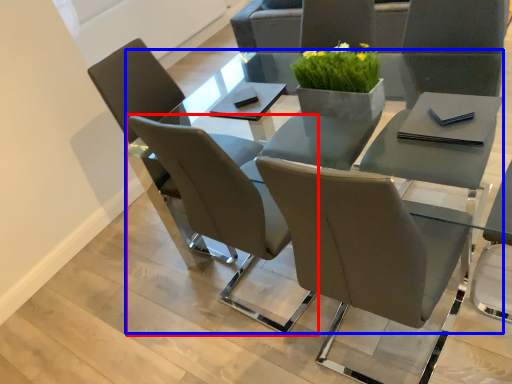
Question: Which of the following is the farthest to the observer, chair (highlighted by a red box) or round table (highlighted by a blue box)?

Choices:
 (A) chair
 (B) round table

Answer: (A)